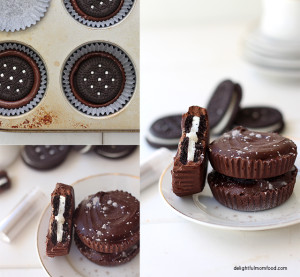
This screenshot has height=277, width=300. What are the coordinates of `plate` in the screenshot? It's located at (213, 219), (74, 275).